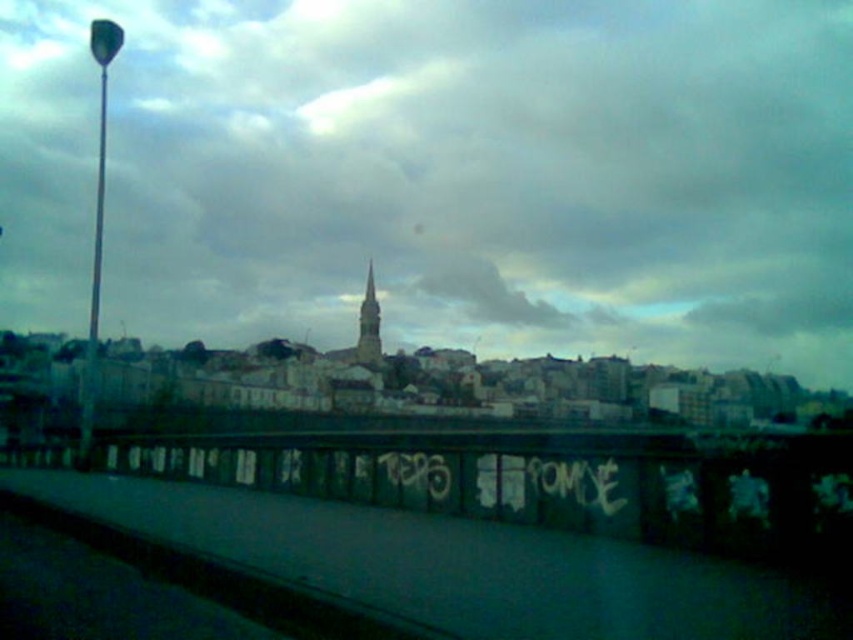
Question: Is cloudy sky at upper center below concrete wall at lower center?

Choices:
 (A) no
 (B) yes

Answer: (A)

Question: Does cloudy sky at upper center have a lesser width compared to concrete wall at lower center?

Choices:
 (A) yes
 (B) no

Answer: (B)

Question: Which point is farther to the camera?

Choices:
 (A) (814, 460)
 (B) (368, 358)
 (C) (289, 257)

Answer: (C)

Question: Among these objects, which one is nearest to the camera?

Choices:
 (A) cloudy sky at upper center
 (B) concrete wall at lower center

Answer: (B)

Question: Which point appears closest to the camera in this image?

Choices:
 (A) (405, 468)
 (B) (224, 230)

Answer: (A)

Question: Does cloudy sky at upper center have a greater width compared to concrete wall at lower center?

Choices:
 (A) yes
 (B) no

Answer: (A)